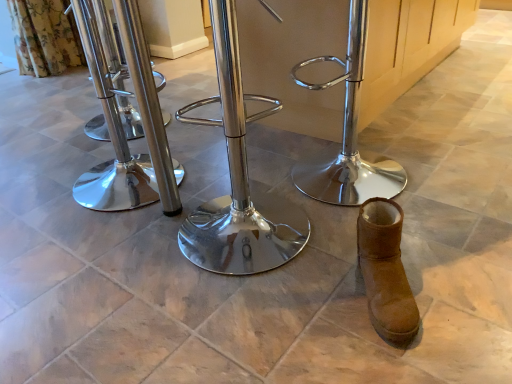
In order to click on empty space that is in between polished metal swivel chair at center, which is the second swivel chair from right to left, and polished metal swivel chair at center, positioned as the 1th swivel chair in right-to-left order in this screenshot , I will do `click(287, 199)`.